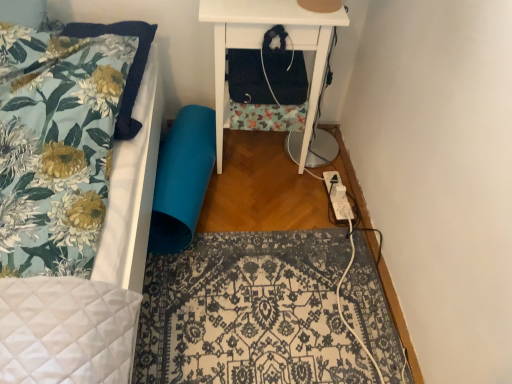
Where is `free area below patterned fabric rug at center (from a real-world perspective)`? This screenshot has width=512, height=384. free area below patterned fabric rug at center (from a real-world perspective) is located at coordinates tap(261, 309).